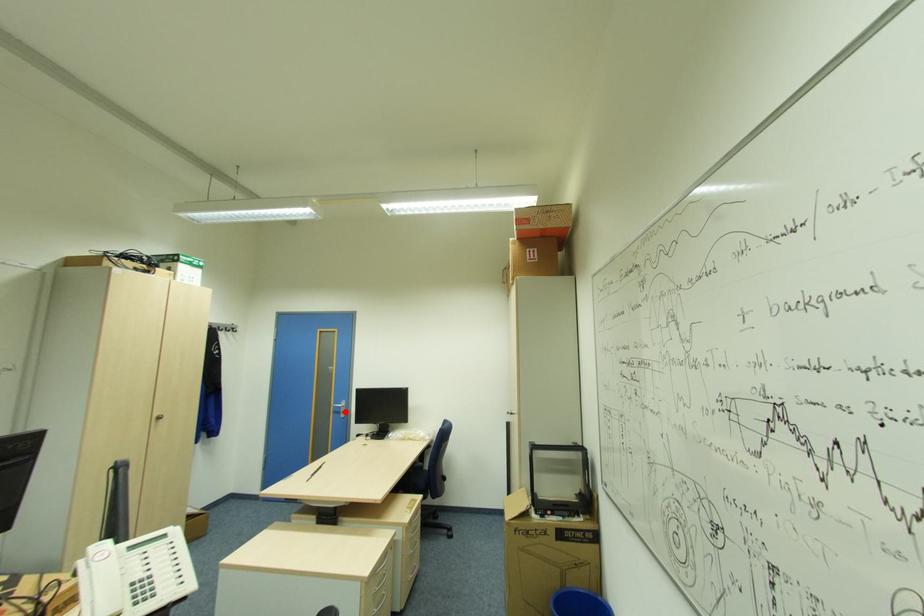
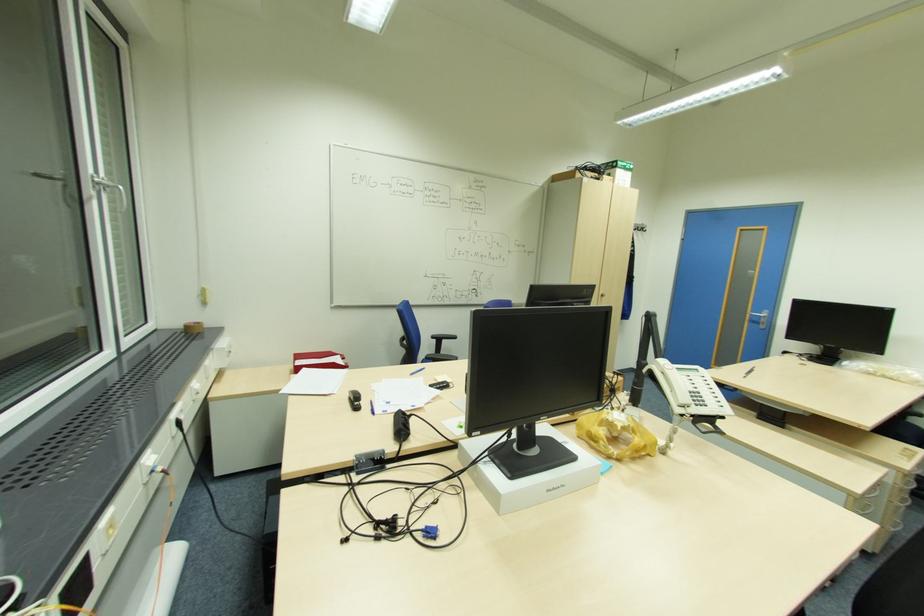
Question: A red point is marked in image1. In image2, is the corresponding 3D point closer to the camera or farther? Reply with the corresponding letter.

Choices:
 (A) The corresponding 3D point is closer.
 (B) The corresponding 3D point is farther.

Answer: (A)